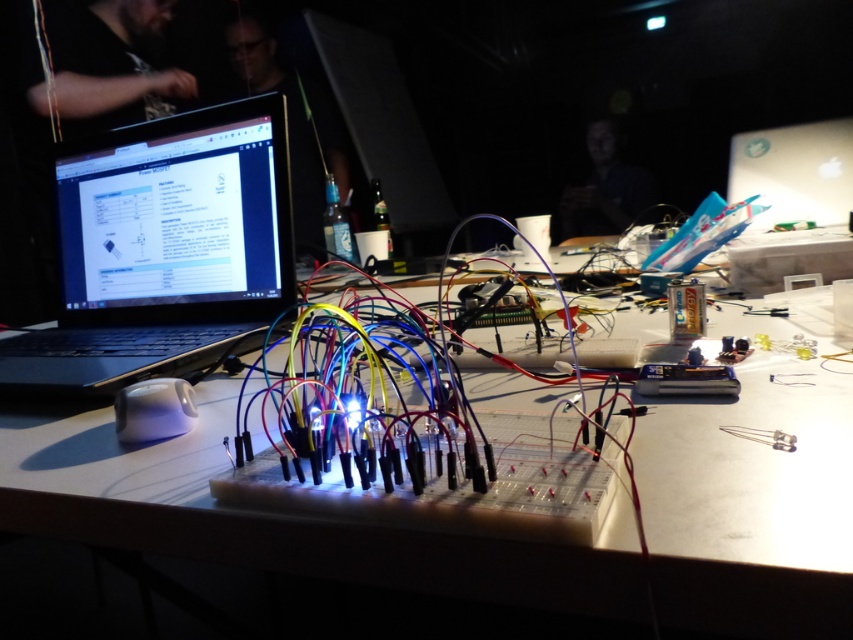
You are holding a 12 inch ruler and want to measure the distance from your eyes to the point marked at coordinates point (x=679, y=576). Can you do this with your ruler?

The distance between you and point (x=679, y=576) is 13.83 inches. Since your ruler is only 12 inches long, it is not long enough to measure the distance from your eyes to the point marked at coordinates point (x=679, y=576).

You are standing in the workspace shown in the image. The white plastic table at center is located at point (x=277, y=516). Can you tell me the coordinates of the white plastic table at center?

The white plastic table at center is located at point (x=277, y=516).

You are setting up a project and need to place a new component on the table. From the image, can you confirm if the white plastic table at center is positioned below the black matte laptop at left?

The white plastic table at center is located below the black matte laptop at left, so yes, the table is positioned below the laptop.